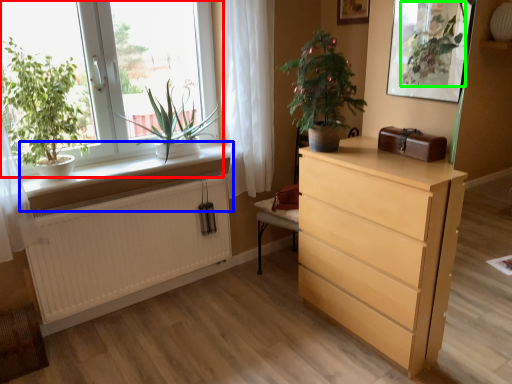
Question: Based on their relative distances, which object is farther from window (highlighted by a red box)? Choose from window sill (highlighted by a blue box) and vegetation (highlighted by a green box).

Choices:
 (A) window sill
 (B) vegetation

Answer: (B)